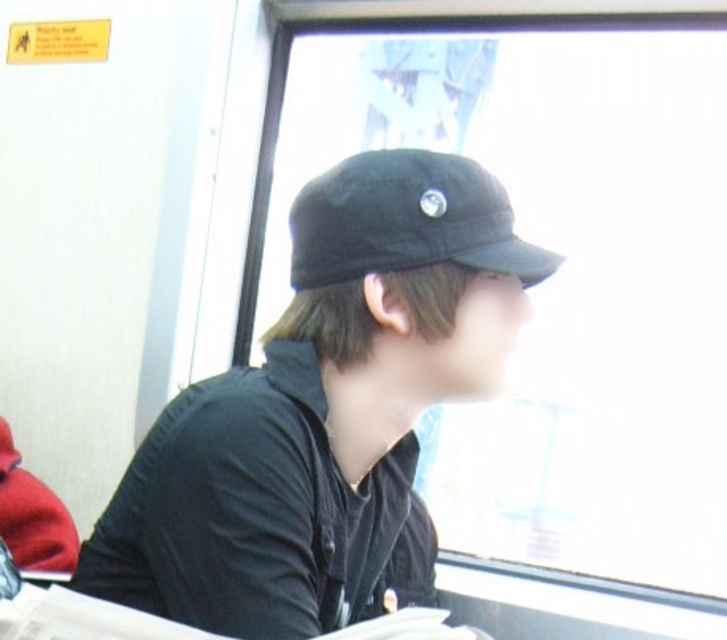
Question: Does transparent glass window at center lie behind black matte cap at center?

Choices:
 (A) yes
 (B) no

Answer: (A)

Question: Which point appears farthest from the camera in this image?

Choices:
 (A) (712, 557)
 (B) (497, 269)
 (C) (358, 166)

Answer: (A)

Question: Which object is the farthest from the black matte cap at center?

Choices:
 (A) transparent glass window at center
 (B) black matte baseball cap at upper center

Answer: (A)

Question: Can you confirm if transparent glass window at center is positioned to the left of black matte cap at center?

Choices:
 (A) no
 (B) yes

Answer: (A)

Question: Which point is closer to the camera?

Choices:
 (A) black matte baseball cap at upper center
 (B) black matte cap at center

Answer: (B)

Question: Is black matte cap at center thinner than black matte baseball cap at upper center?

Choices:
 (A) no
 (B) yes

Answer: (A)